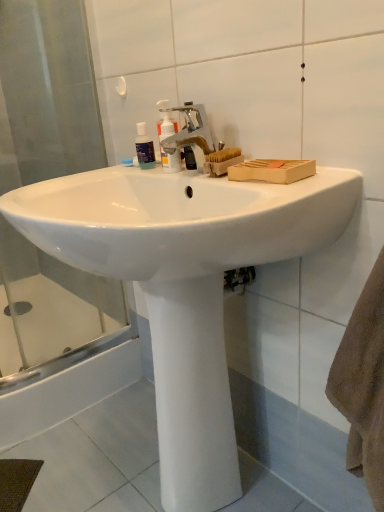
This screenshot has width=384, height=512. I want to click on free point to the left of translucent plastic pump bottle at center, so (102, 173).